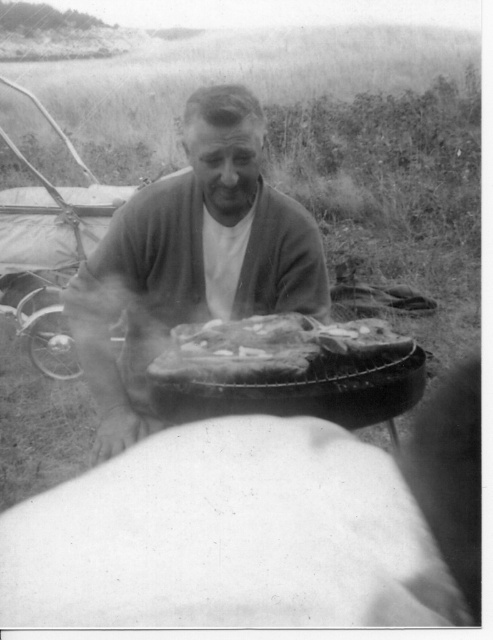
Question: Can you confirm if smooth leather jacket at center is thinner than charred wooden platter at center?

Choices:
 (A) no
 (B) yes

Answer: (A)

Question: Which point is farther from the camera taking this photo?

Choices:
 (A) (146, 257)
 (B) (170, 380)

Answer: (A)

Question: Does smooth leather jacket at center appear on the right side of charred wooden platter at center?

Choices:
 (A) no
 (B) yes

Answer: (A)

Question: Is smooth leather jacket at center below charred wooden platter at center?

Choices:
 (A) yes
 (B) no

Answer: (B)

Question: Which of the following is the farthest from the observer?

Choices:
 (A) [x=336, y=339]
 (B) [x=154, y=348]

Answer: (B)